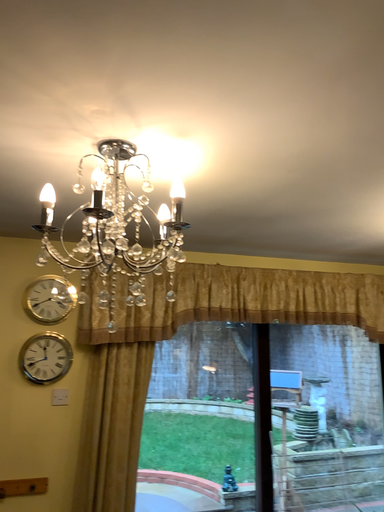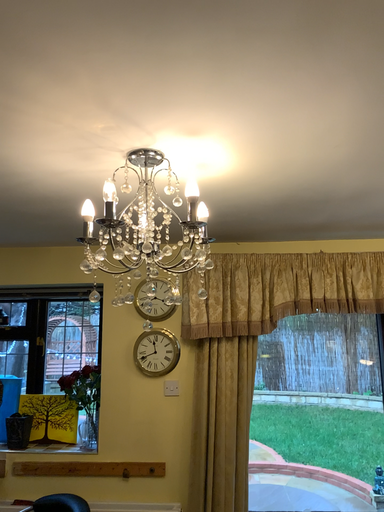
Question: Which way did the camera rotate in the video?

Choices:
 (A) rotated right
 (B) rotated left

Answer: (B)